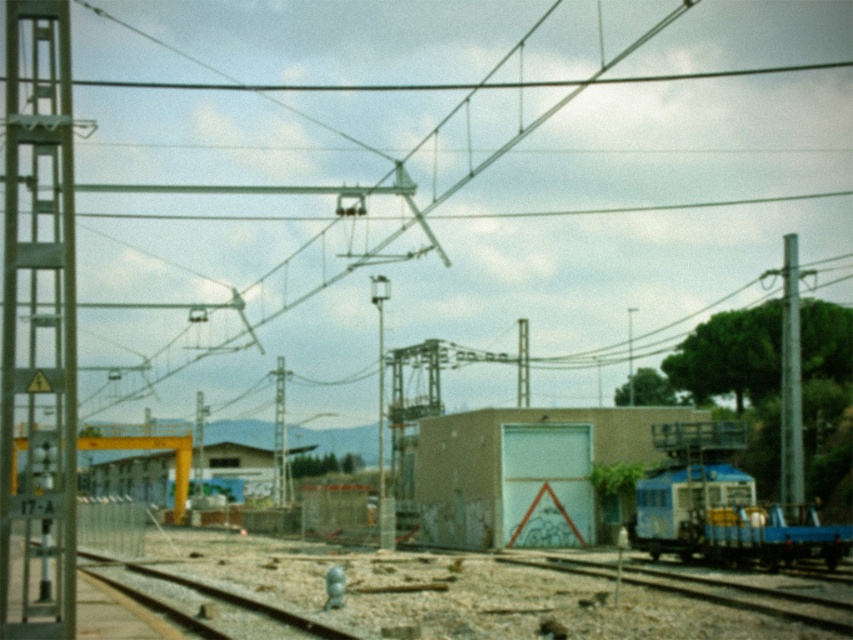
You are a railway engineer inspecting the tracks. You notice the blue metallic train at lower right and the smooth metal rail at center. Which object has a smaller width when viewed from above?

The blue metallic train at lower right is thinner than the smooth metal rail at center, so the blue metallic train at lower right has a smaller width when viewed from above.

You are a railway worker standing at the base of the metallic pole at right. You need to reach the light brown concrete building at center for a meeting. Which direction should you walk to get there?

You should walk towards the light brown concrete building at center because it is closer to you than the metallic pole at right, so you can move forward in that direction.